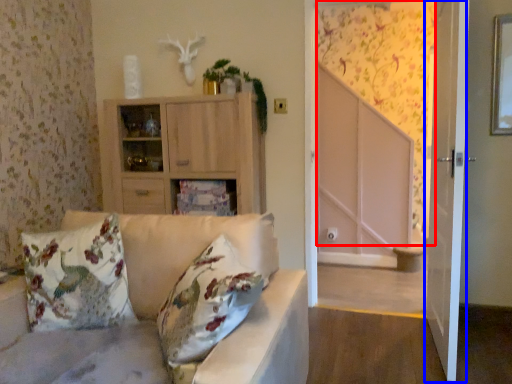
Question: Which object is closer to the camera taking this photo, curtain (highlighted by a red box) or screen door (highlighted by a blue box)?

Choices:
 (A) curtain
 (B) screen door

Answer: (B)